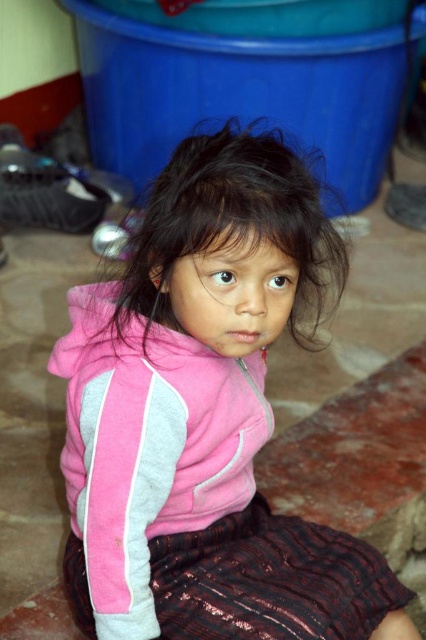
Between pink fabric at center and dark brown silky hair at center, which one appears on the left side from the viewer's perspective?

Positioned to the left is pink fabric at center.

Can you confirm if pink fabric at center is bigger than dark brown silky hair at center?

Indeed, pink fabric at center has a larger size compared to dark brown silky hair at center.

Who is more distant from viewer, [218,474] or [293,182]?

The point [218,474] is more distant.

Where is `pink fabric at center`? The width and height of the screenshot is (426, 640). pink fabric at center is located at coordinates (206, 417).